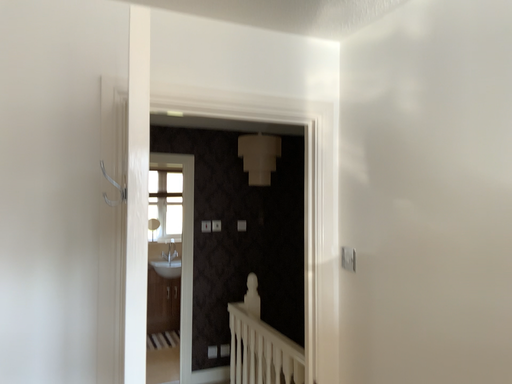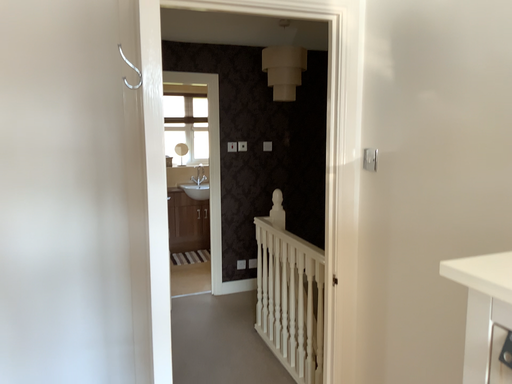
Question: Which way did the camera rotate in the video?

Choices:
 (A) rotated upward
 (B) rotated downward

Answer: (B)